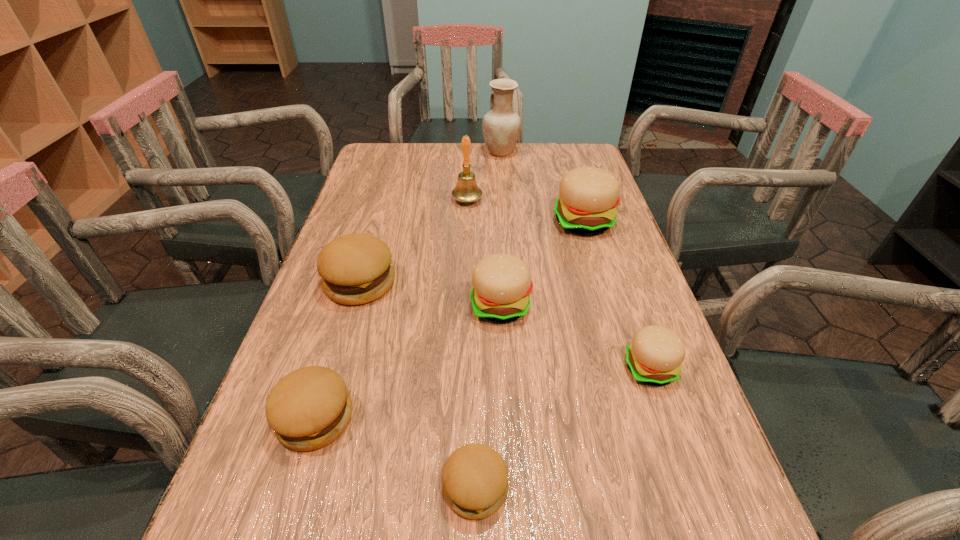
Select which beige hamburger is the closest to the second smallest brown hamburger. Please provide its 2D coordinates. Your answer should be formatted as a tuple, i.e. [(x, y)], where the tuple contains the x and y coordinates of a point satisfying the conditions above.

[(502, 284)]

I want to click on the second closest beige hamburger to the nearest beige hamburger, so click(x=588, y=196).

Where is `brown hamburger that can be found as the second closest to the biggest brown hamburger`? The height and width of the screenshot is (540, 960). brown hamburger that can be found as the second closest to the biggest brown hamburger is located at coordinates (475, 478).

Locate an element on the screen. This screenshot has height=540, width=960. brown hamburger that is the second closest to the second smallest beige hamburger is located at coordinates (309, 408).